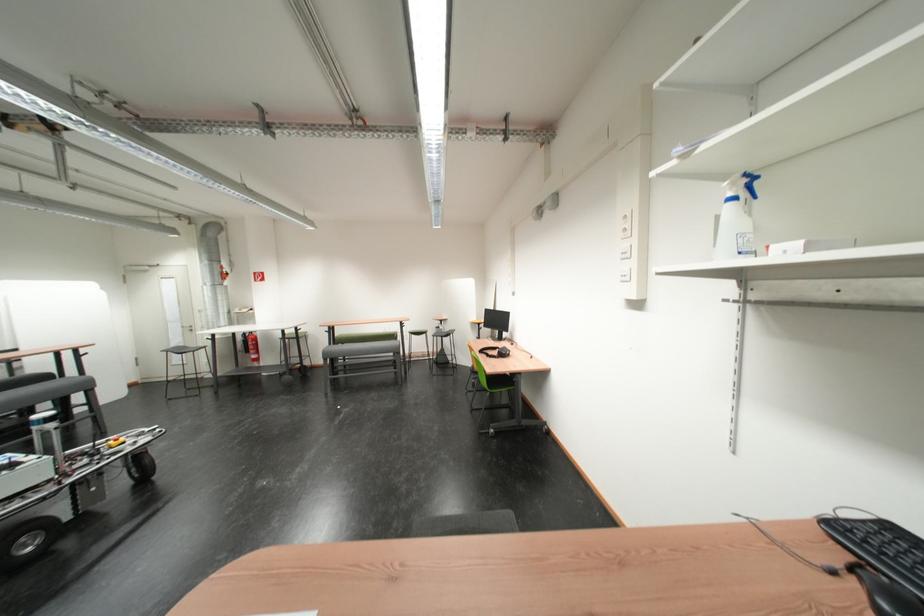
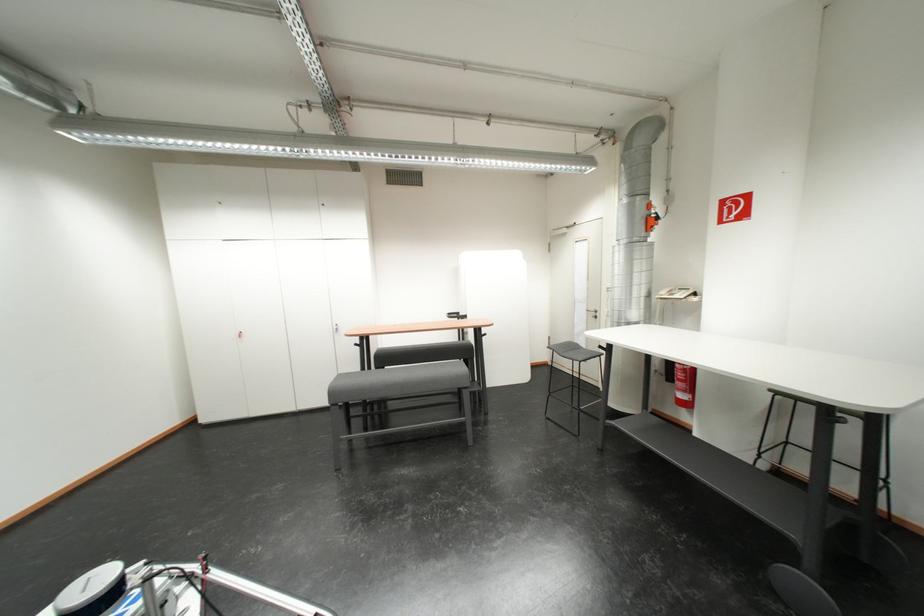
Where in the second image is the point corresponding to point 174,354 from the first image?

(560, 350)